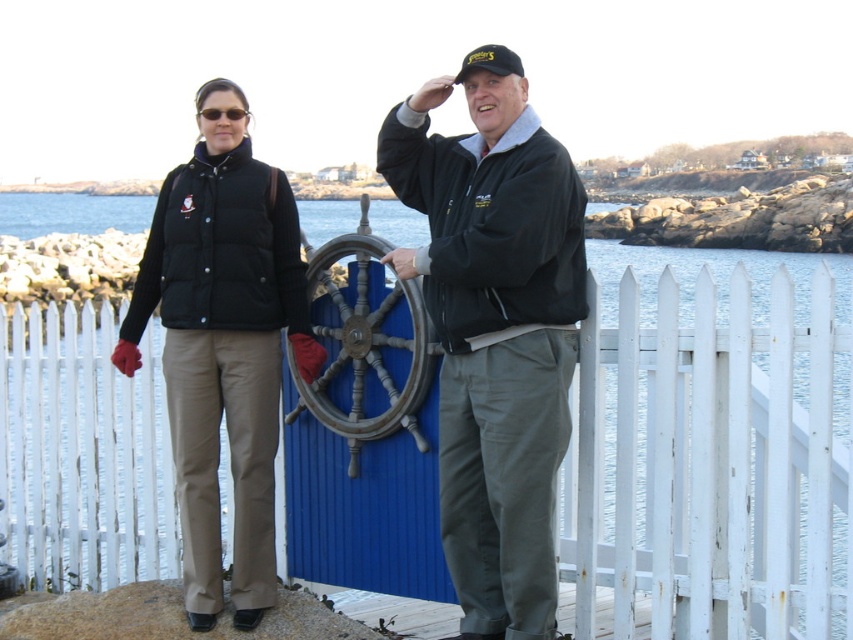
You are a photographer trying to capture a closeup shot of both the matte black vest at center and the matte black jacket at center in the scene. Your camera has a lens that can focus on objects within a 10 inch range. Can you fit both items within the camera lens range?

The matte black vest at center and matte black jacket at center are 12.72 inches apart from each other. Since the distance between them exceeds the 10 inch range of the camera lens, you cannot fit both items within the camera lens range.

What is the color of the vest worn by the person standing at the coordinates point (495, 330)?

The vest at point (495, 330) is matte black.